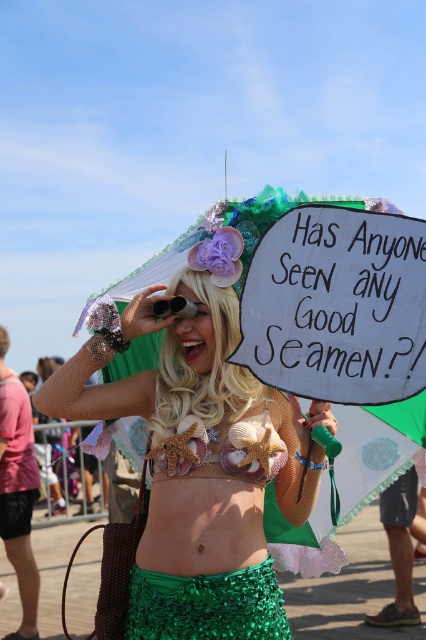
Question: Is the position of blonde hair wig at center less distant than that of seashell bikini top at center?

Choices:
 (A) no
 (B) yes

Answer: (A)

Question: Is green sequined skirt at lower center behind seashell bikini top at center?

Choices:
 (A) no
 (B) yes

Answer: (A)

Question: Which of the following is the farthest from the observer?

Choices:
 (A) (264, 602)
 (B) (247, 429)

Answer: (B)

Question: Can you confirm if green sequined skirt at lower center is smaller than seashell bikini top at center?

Choices:
 (A) no
 (B) yes

Answer: (A)

Question: Which point is closer to the camera taking this photo?

Choices:
 (A) (278, 401)
 (B) (215, 332)

Answer: (B)

Question: Among these objects, which one is nearest to the camera?

Choices:
 (A) green sequined skirt at lower center
 (B) blonde hair wig at center
 (C) seashell bikini top at center

Answer: (A)